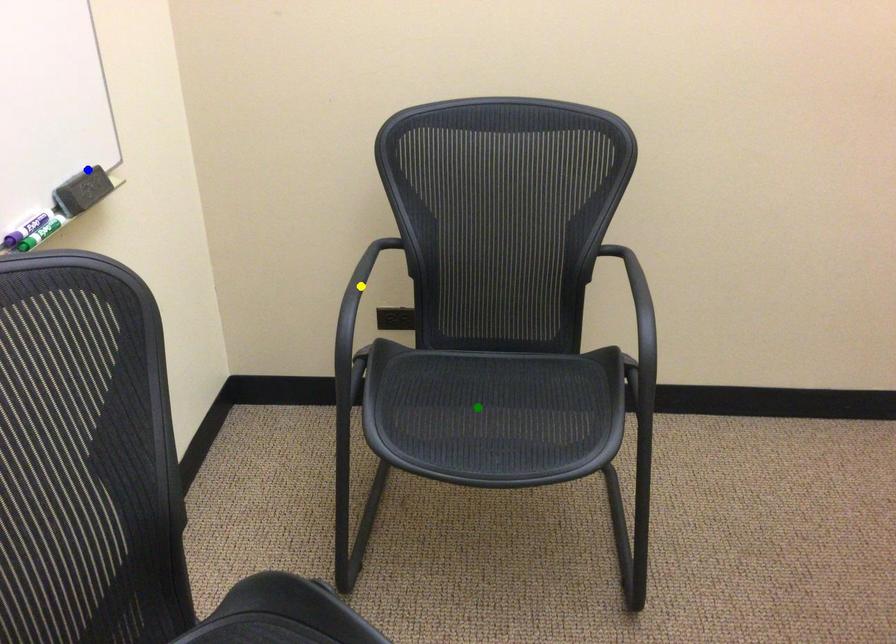
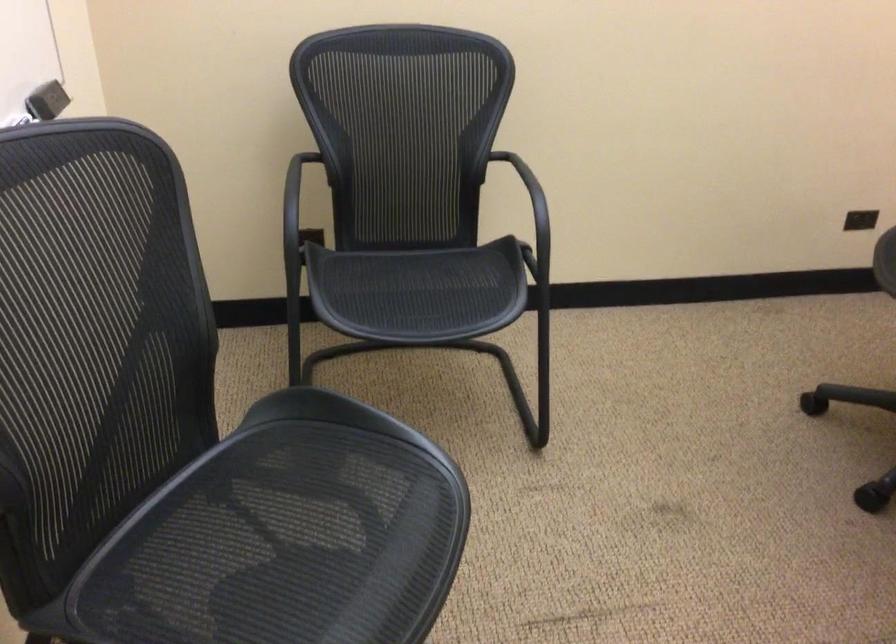
I am providing you with two images of the same scene from different viewpoints. Three points are marked in image1. Which point corresponds to a part or object that is occluded in image2?In image1, three points are marked. Which of them correspond to a part or object that is occluded in image2?Among the three points shown in image1, which one corresponds to a part or object that is no longer visible due to occlusion in image2?

yellow point cannot be seen in image2.